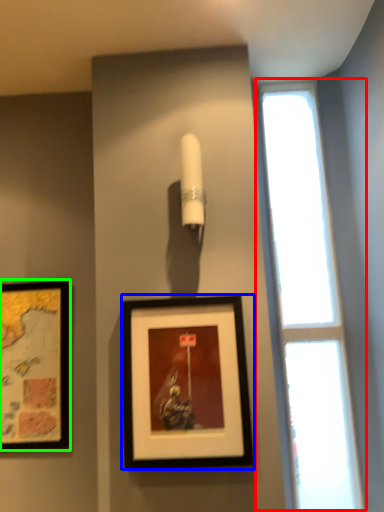
Question: Which object is positioned farthest from window (highlighted by a red box)? Select from picture frame (highlighted by a blue box) and picture frame (highlighted by a green box).

Choices:
 (A) picture frame
 (B) picture frame

Answer: (B)